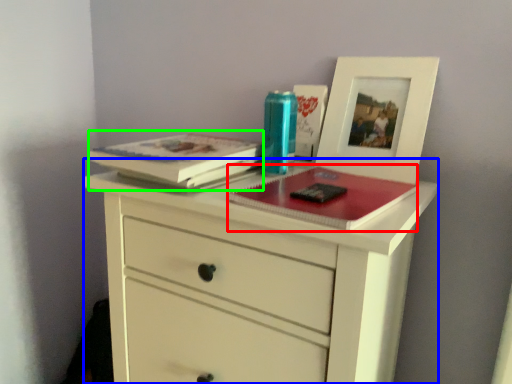
Question: Based on their relative distances, which object is farther from magazine (highlighted by a red box)? Choose from chest of drawers (highlighted by a blue box) and paperback book (highlighted by a green box).

Choices:
 (A) chest of drawers
 (B) paperback book

Answer: (B)